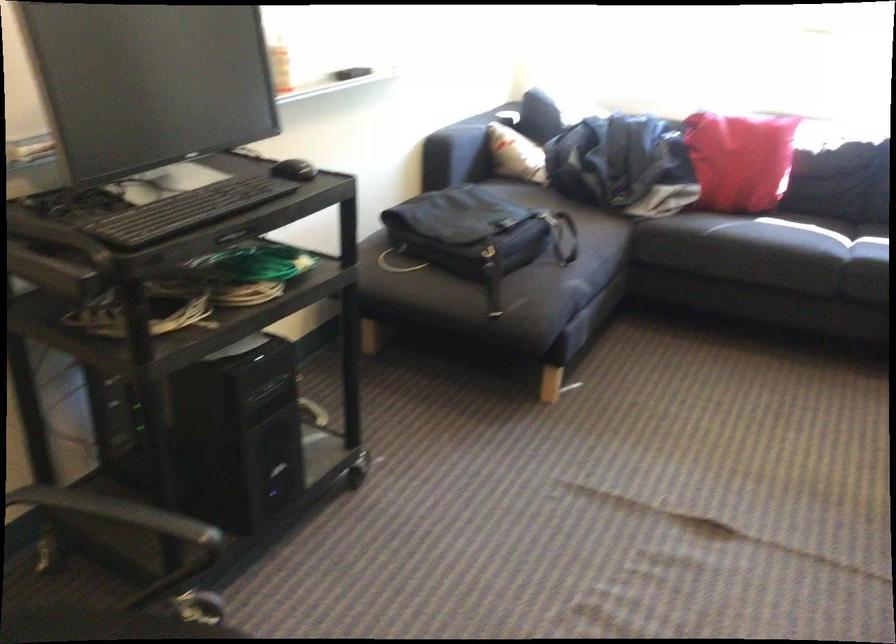
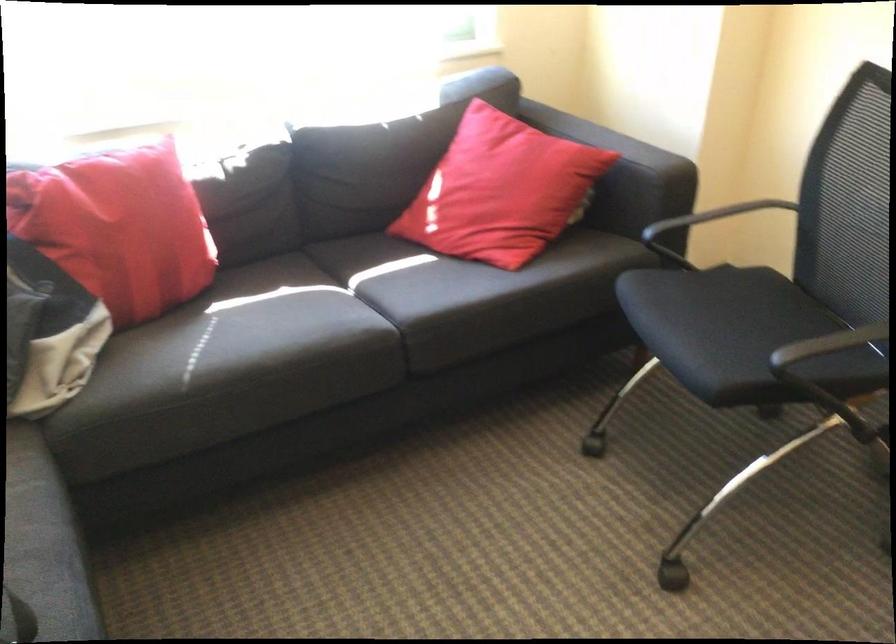
Where in the second image is the point corresponding to [734,147] from the first image?

(117, 228)